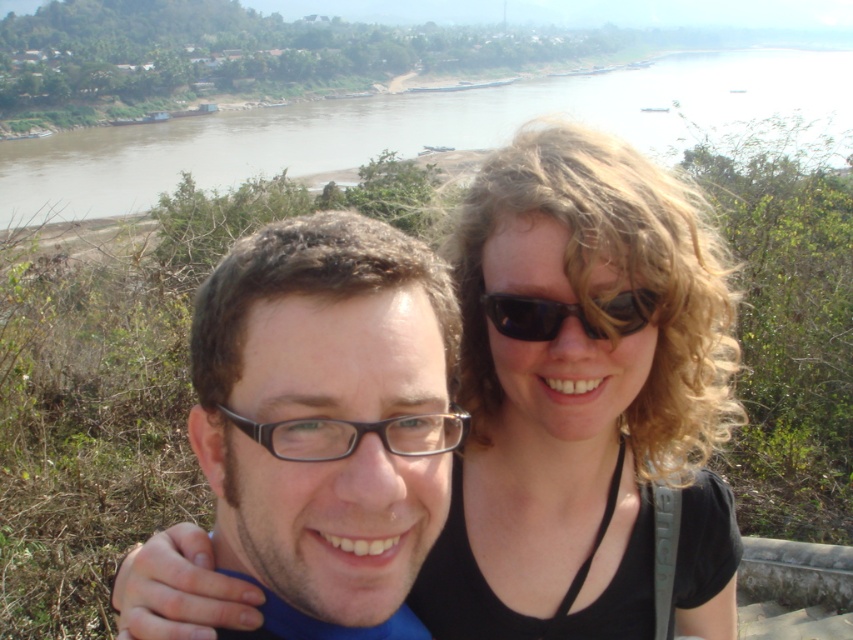
Question: Can you confirm if black matte hair at center is positioned above black plastic glasses at center?

Choices:
 (A) no
 (B) yes

Answer: (B)

Question: Which point is farther to the camera?

Choices:
 (A) matte black glasses at center
 (B) black matte hair at center
 (C) black plastic glasses at center

Answer: (B)

Question: Which object is positioned closest to the black matte hair at center?

Choices:
 (A) brown muddy water at upper center
 (B) matte black glasses at center
 (C) black plastic sunglasses at center
 (D) black plastic glasses at center

Answer: (C)

Question: Which point is farther from the camera taking this photo?

Choices:
 (A) (405, 422)
 (B) (393, 456)
 (C) (329, 128)
 (D) (531, 330)

Answer: (C)

Question: In this image, where is black matte hair at center located relative to black plastic glasses at center?

Choices:
 (A) above
 (B) below

Answer: (A)

Question: Is black matte hair at center positioned in front of black plastic glasses at center?

Choices:
 (A) no
 (B) yes

Answer: (A)